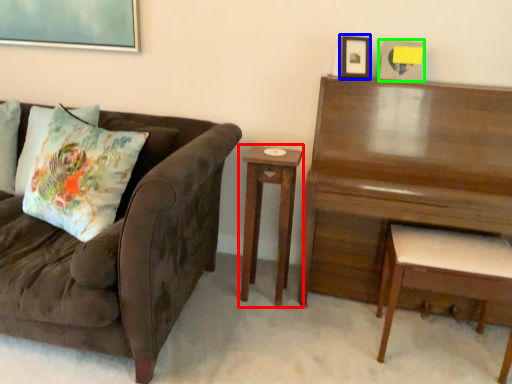
Question: Which object is positioned farthest from nightstand (highlighted by a red box)? Select from picture frame (highlighted by a blue box) and picture frame (highlighted by a green box).

Choices:
 (A) picture frame
 (B) picture frame

Answer: (B)